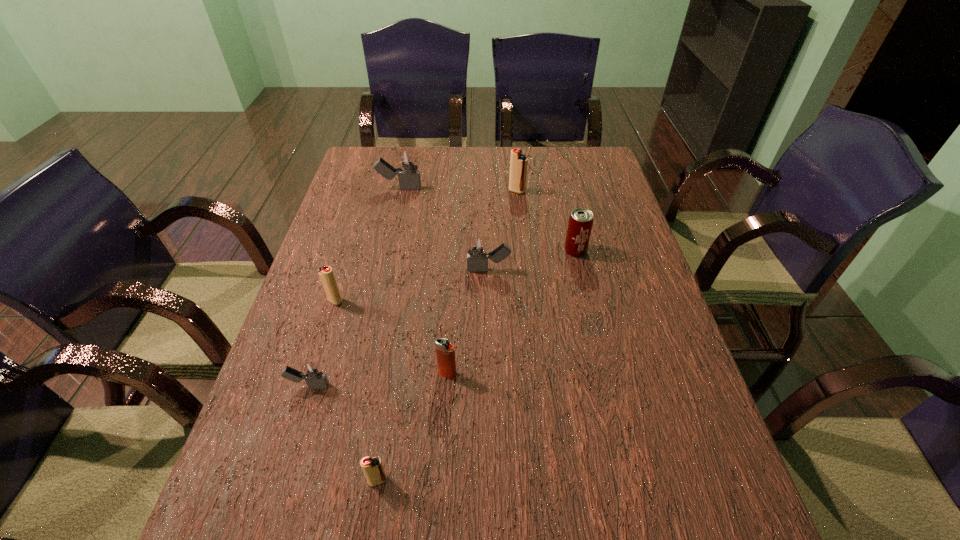
This screenshot has height=540, width=960. I want to click on the farthest red igniter, so (x=518, y=162).

Where is `the biggest red igniter`? the biggest red igniter is located at coordinates (518, 162).

The height and width of the screenshot is (540, 960). Identify the location of the biggest gray igniter. (409, 178).

The height and width of the screenshot is (540, 960). What are the coordinates of `beer can` in the screenshot? It's located at (580, 223).

You are a GUI agent. You are given a task and a screenshot of the screen. Output one action in this format:
    pyautogui.click(x=<x>, y=<y>)
    Task: Click on the rightmost object
    The width and height of the screenshot is (960, 540).
    Given the screenshot: What is the action you would take?
    pyautogui.click(x=580, y=223)

The image size is (960, 540). Identify the location of the fourth farthest object. (478, 252).

Find the location of a particular element. the sixth object from left to right is located at coordinates (478, 252).

This screenshot has width=960, height=540. What are the coordinates of `the leftmost red igniter` in the screenshot? It's located at (326, 275).

The image size is (960, 540). I want to click on the second biggest red igniter, so point(326,275).

At what (x,y) coordinates should I click in order to perform the action: click on the fifth object from left to right. Please return your answer as a coordinate pair (x, y). Looking at the image, I should click on (445, 352).